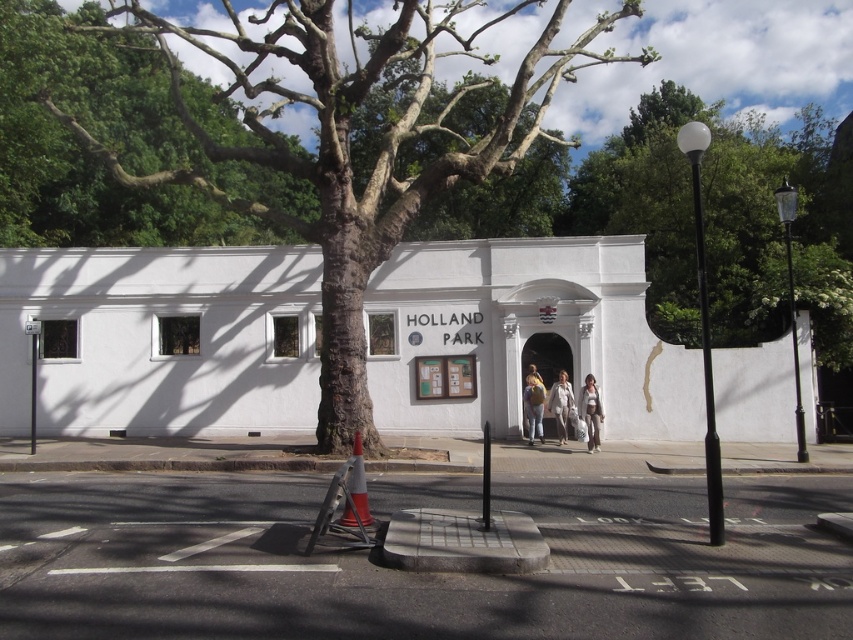
You are a pedestrian walking on the pavement in front of the HOLLAND PARK building. You see the green leafy tree at upper center and the light beige coat at center. Which object is bigger?

The green leafy tree at upper center is larger in size than the light beige coat at center, so the green leafy tree at upper center is bigger.

You are standing in front of the HOLLAND PARK building and want to take a photo of the green leafy tree at upper center. If the recommended distance for clear photography is 50 feet, will you need to move closer or farther away?

The green leafy tree at upper center is 57.44 feet away from camera, which is farther than the recommended 50 feet. To take a clear photo, you should move closer to reduce the distance to 50 feet.

You are a visitor approaching the HOLLAND PARK building and notice the green leafy tree at upper center and the light beige coat at center. From your perspective, which object is positioned to the right side?

The green leafy tree at upper center is to the right of the light beige coat at center.